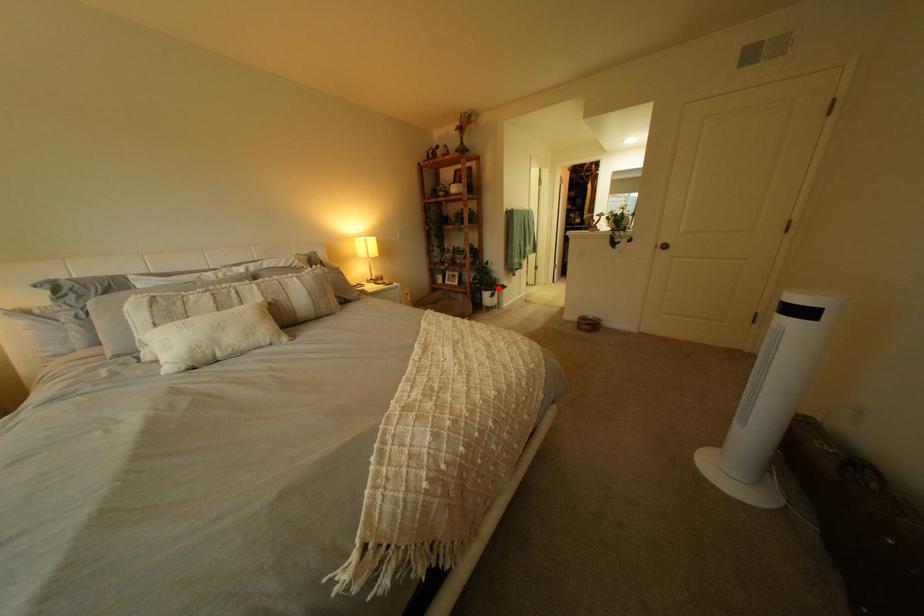
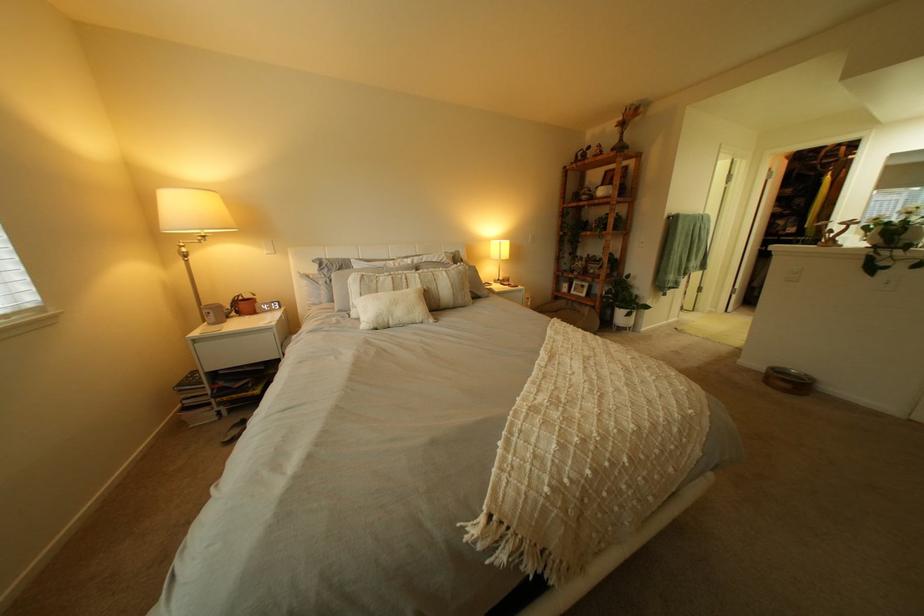
The point at the highlighted location is marked in the first image. Where is the corresponding point in the second image?

(633, 305)